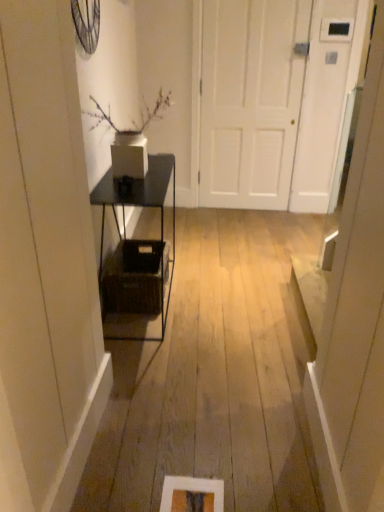
Question: Considering the relative sizes of white matte door at center and brown woven basket at center in the image provided, is white matte door at center smaller than brown woven basket at center?

Choices:
 (A) no
 (B) yes

Answer: (A)

Question: Is white matte door at center in front of brown woven basket at center?

Choices:
 (A) no
 (B) yes

Answer: (A)

Question: From a real-world perspective, is white matte door at center positioned over brown woven basket at center based on gravity?

Choices:
 (A) no
 (B) yes

Answer: (B)

Question: Could you tell me if white matte door at center is turned towards brown woven basket at center?

Choices:
 (A) no
 (B) yes

Answer: (B)

Question: Is white matte door at center shorter than brown woven basket at center?

Choices:
 (A) yes
 (B) no

Answer: (B)

Question: Is white matte door at center behind brown woven basket at center?

Choices:
 (A) yes
 (B) no

Answer: (A)

Question: Considering the relative sizes of brown woven basket at center and white matte door at center in the image provided, is brown woven basket at center smaller than white matte door at center?

Choices:
 (A) no
 (B) yes

Answer: (B)

Question: Is white matte door at center a part of brown woven basket at center?

Choices:
 (A) no
 (B) yes

Answer: (A)

Question: Is brown woven basket at center taller than white matte door at center?

Choices:
 (A) no
 (B) yes

Answer: (A)

Question: Is brown woven basket at center thinner than white matte door at center?

Choices:
 (A) yes
 (B) no

Answer: (B)

Question: Is brown woven basket at center positioned behind white matte door at center?

Choices:
 (A) no
 (B) yes

Answer: (A)

Question: From a real-world perspective, is brown woven basket at center physically below white matte door at center?

Choices:
 (A) yes
 (B) no

Answer: (A)

Question: Is black metal shelf at center turned away from brown woven basket at center?

Choices:
 (A) yes
 (B) no

Answer: (A)